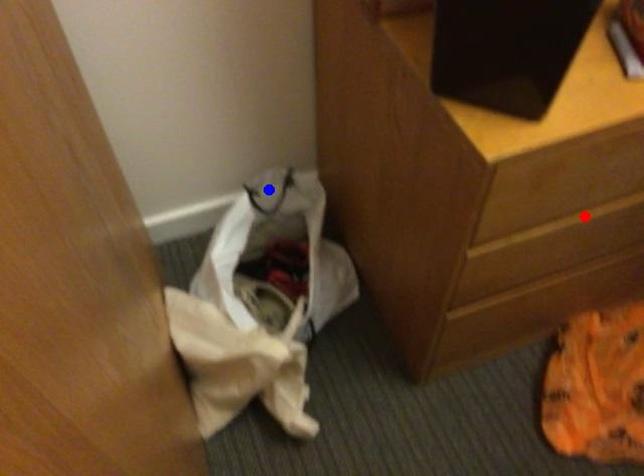
Question: Which of the two points in the image is closer to the camera?

Choices:
 (A) Blue point is closer.
 (B) Red point is closer.

Answer: (B)